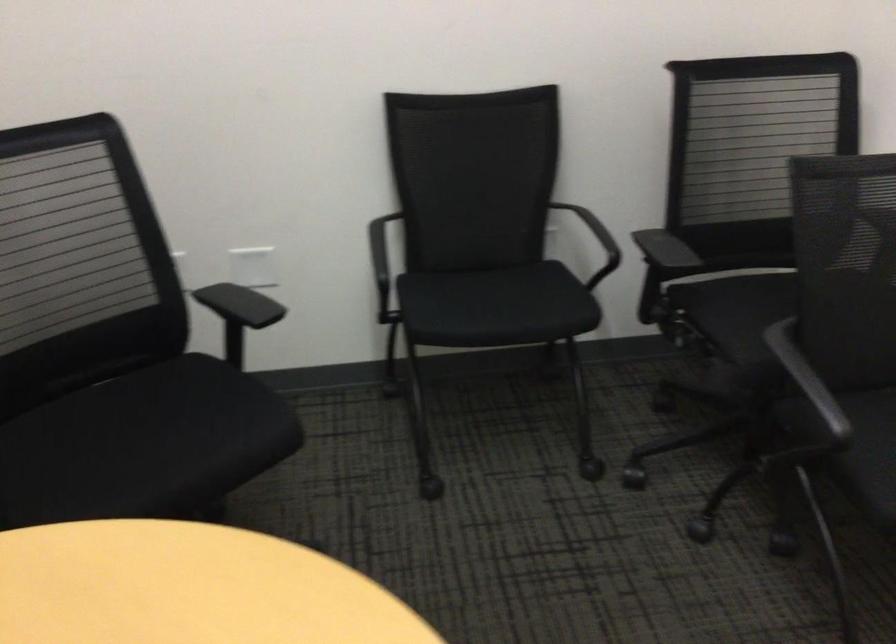
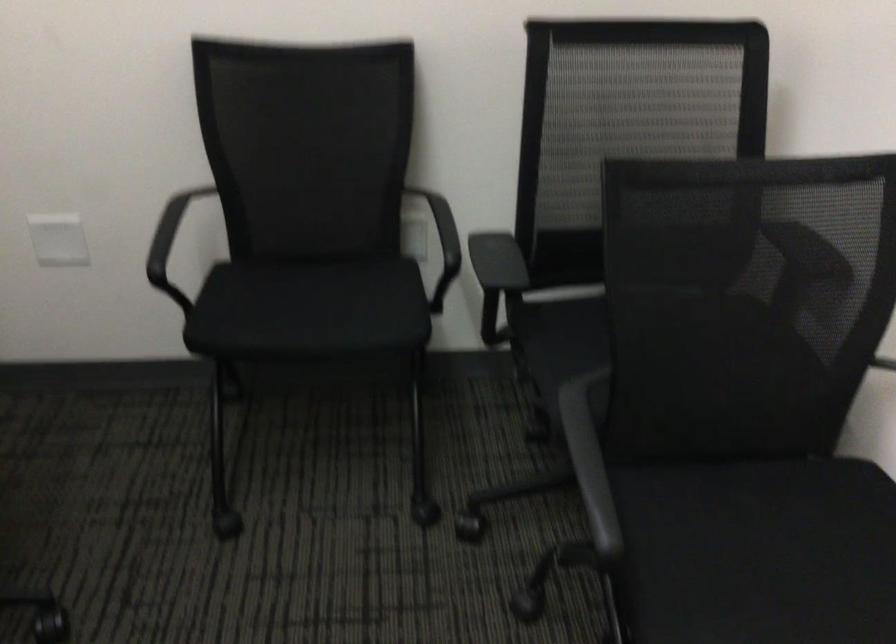
Question: The images are taken continuously from a first-person perspective. In which direction is your viewpoint rotating?

Choices:
 (A) Left
 (B) Right
 (C) Up
 (D) Down

Answer: (D)